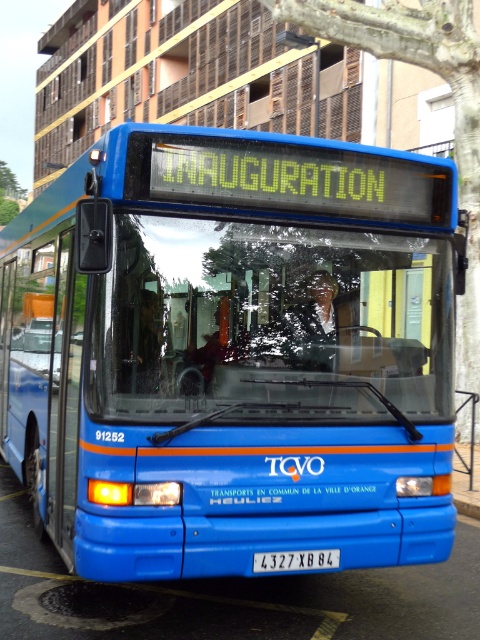
Question: Is blue matte bus at center wider than transparent glass windshield at center?

Choices:
 (A) yes
 (B) no

Answer: (B)

Question: Which object appears farthest from the camera in this image?

Choices:
 (A) blue matte bus at center
 (B) transparent glass windshield at center

Answer: (A)

Question: Among these objects, which one is farthest from the camera?

Choices:
 (A) transparent glass windshield at center
 (B) blue matte bus at center

Answer: (B)

Question: Which object is closer to the camera taking this photo?

Choices:
 (A) transparent glass windshield at center
 (B) white plastic license plate at center

Answer: (A)

Question: Can you confirm if blue matte bus at center is positioned to the left of smooth bark tree at upper center?

Choices:
 (A) no
 (B) yes

Answer: (B)

Question: Does blue matte bus at center appear on the right side of transparent glass windshield at center?

Choices:
 (A) no
 (B) yes

Answer: (B)